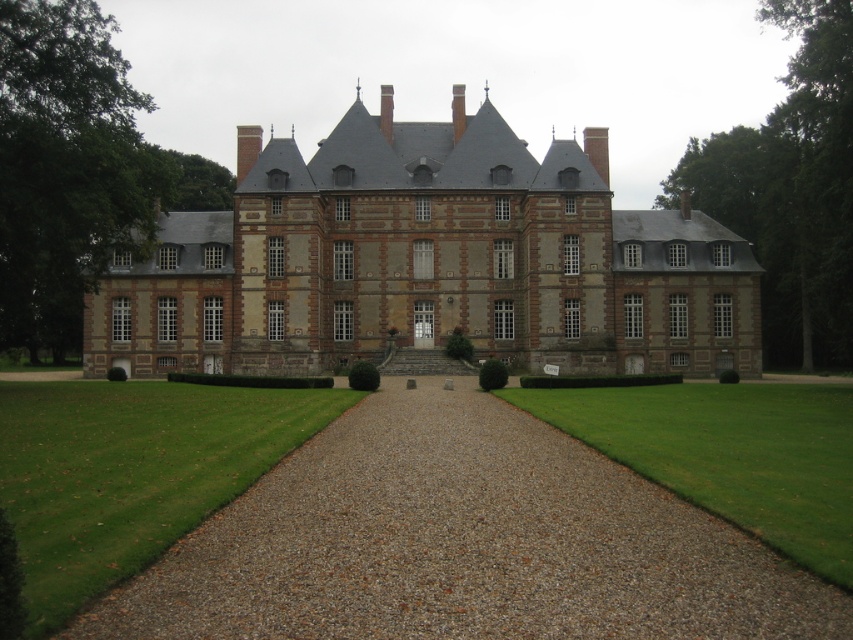
You are standing at the entrance of the brown brick castle at center. If you walk straight ahead, which direction will you face relative to the castle?

Since the brown brick castle at center is located at point coordinates, you would face the direction corresponding to the castle.

You are a visitor standing in front of the brown brick castle at center and the gray gravel at center. Which object is wider?

The brown brick castle at center might be wider than gray gravel at center.